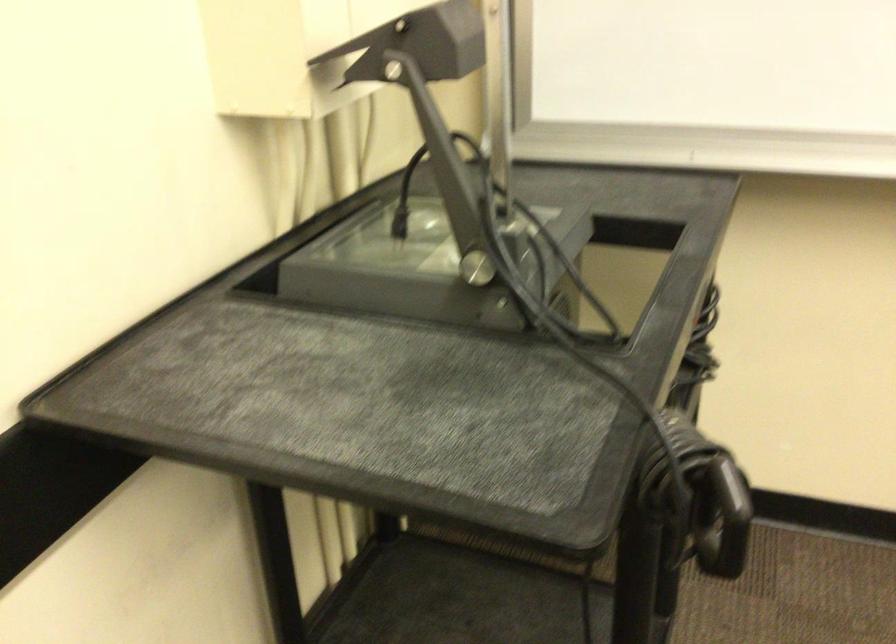
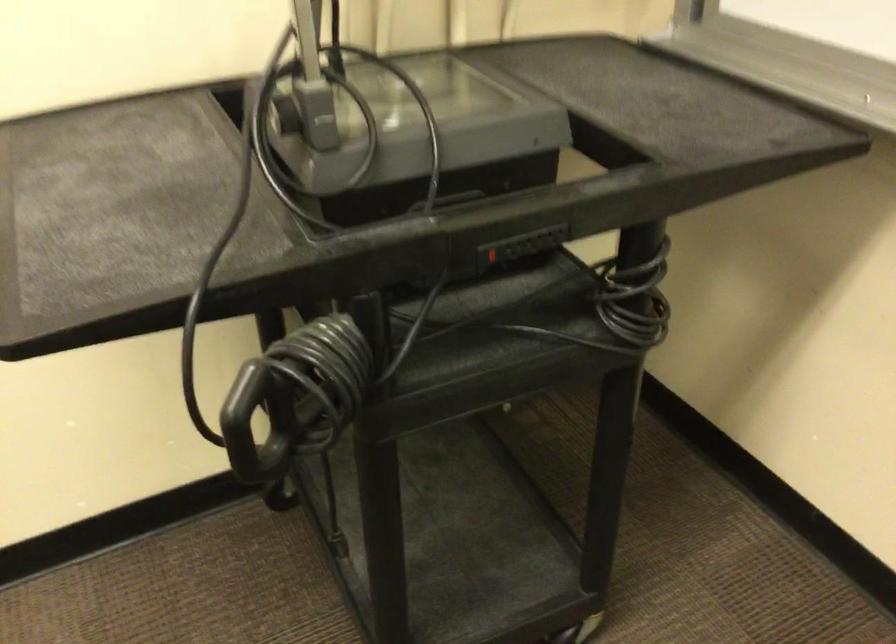
Question: Based on the continuous images, in which direction is the camera rotating? Reply with the corresponding letter.

Choices:
 (A) Left
 (B) Right
 (C) Up
 (D) Down

Answer: (A)